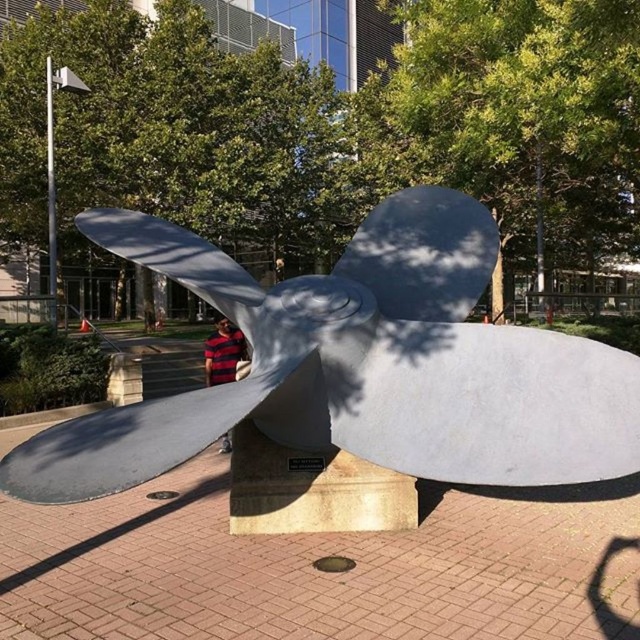
Who is more distant from viewer, [12,493] or [236,330]?

The point [236,330] is more distant.

Is point (474, 419) farther from camera compared to point (218, 332)?

No, it is in front of (218, 332).

Which is in front, point (337, 353) or point (228, 333)?

Positioned in front is point (337, 353).

Find the location of a particular element. satin silver propeller at center is located at coordinates (358, 365).